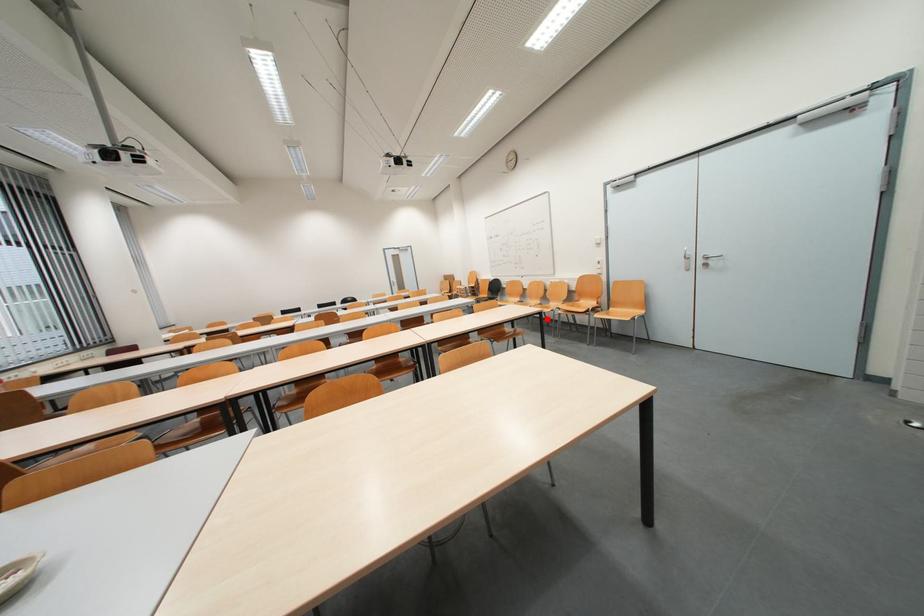
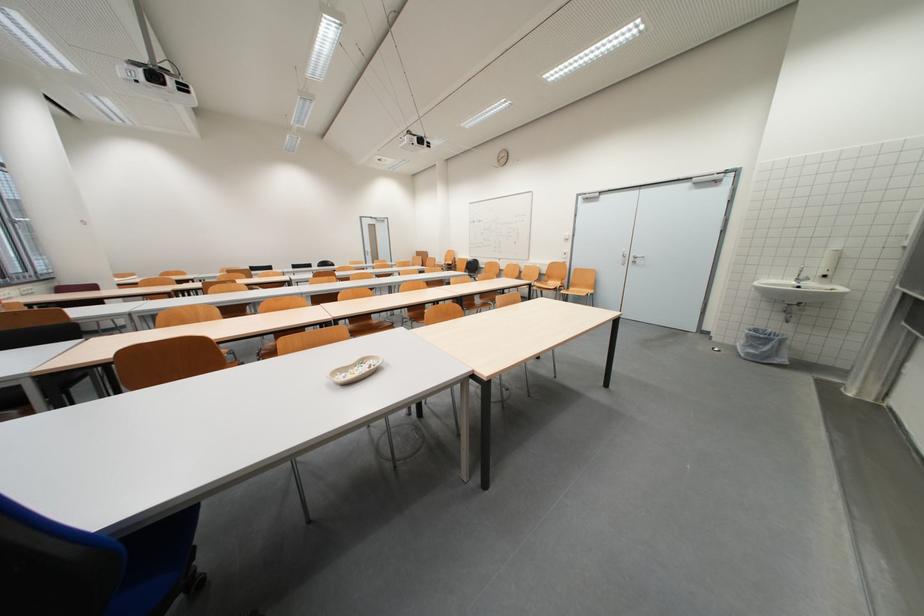
In the second image, find the point that corresponds to the highlighted location in the first image.

(537, 291)